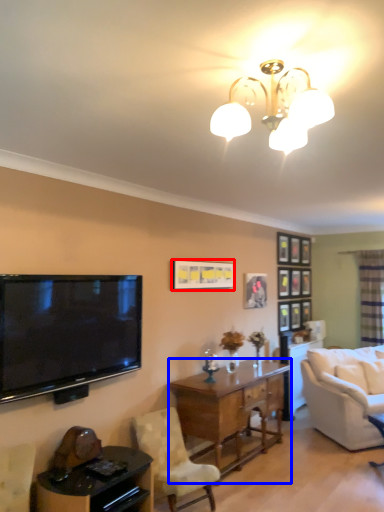
Question: Which object is further to the camera taking this photo, picture frame (highlighted by a red box) or desk (highlighted by a blue box)?

Choices:
 (A) picture frame
 (B) desk

Answer: (A)